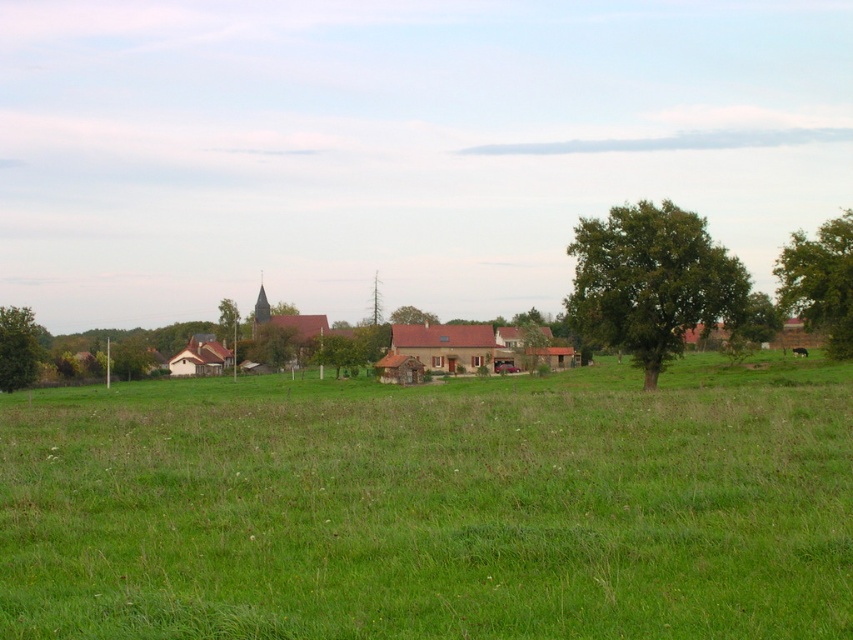
Question: Considering the relative positions of green grass pasture at center and green leafy tree at center in the image provided, where is green grass pasture at center located with respect to green leafy tree at center?

Choices:
 (A) left
 (B) right

Answer: (B)

Question: Is green grass pasture at center positioned at the back of green leafy tree at center?

Choices:
 (A) yes
 (B) no

Answer: (B)

Question: Does green grass pasture at center have a greater width compared to green leafy tree at center-right?

Choices:
 (A) no
 (B) yes

Answer: (B)

Question: Which point is closer to the camera?

Choices:
 (A) green leafy tree at right
 (B) green leafy tree at left
 (C) green grass pasture at center

Answer: (C)

Question: Which point is closer to the camera taking this photo?

Choices:
 (A) (396, 308)
 (B) (16, 348)
 (C) (44, 540)

Answer: (C)

Question: Which point appears closest to the camera in this image?

Choices:
 (A) (393, 321)
 (B) (26, 353)
 (C) (456, 387)

Answer: (B)